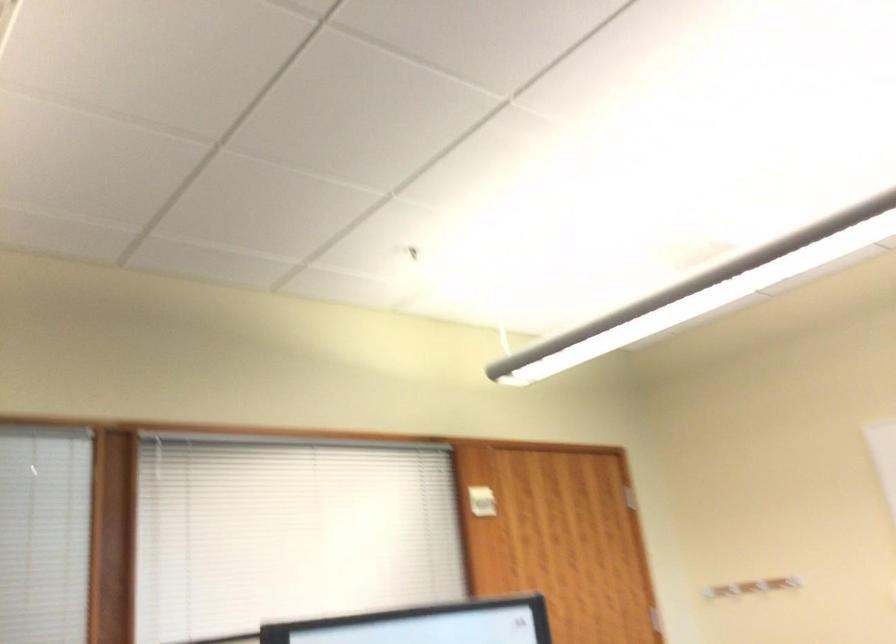
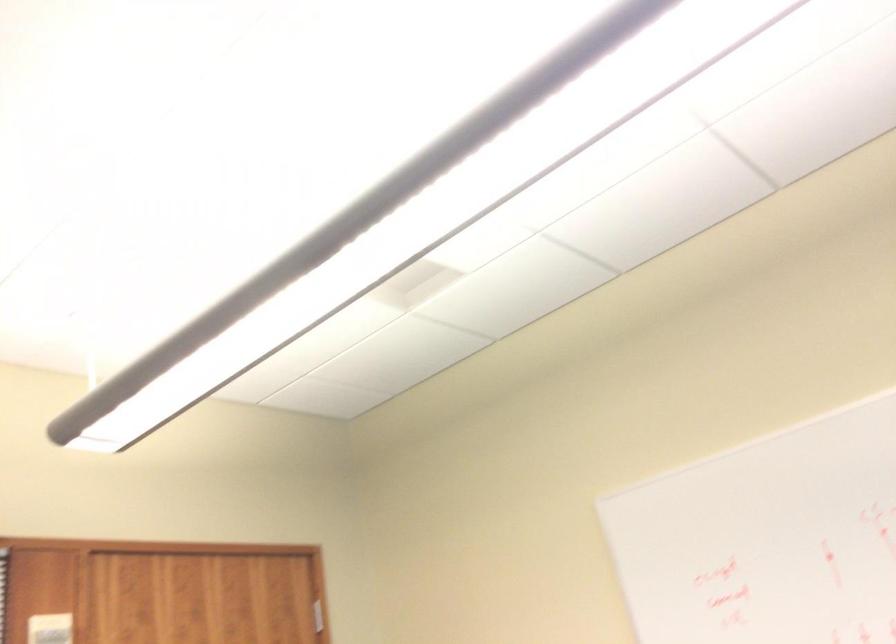
Locate, in the second image, the point that corresponds to point (440, 489) in the first image.

(49, 629)